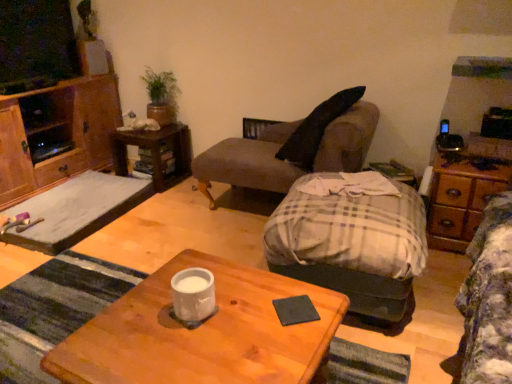
Question: Considering the relative sizes of gray fabric couch at center, positioned as the 2th studio couch in front-to-back order, and wooden dresser at right in the image provided, is gray fabric couch at center, positioned as the 2th studio couch in front-to-back order, thinner than wooden dresser at right?

Choices:
 (A) yes
 (B) no

Answer: (B)

Question: Considering the relative sizes of gray fabric couch at center, placed as the 1th studio couch when sorted from back to front, and wooden dresser at right in the image provided, is gray fabric couch at center, placed as the 1th studio couch when sorted from back to front, bigger than wooden dresser at right?

Choices:
 (A) no
 (B) yes

Answer: (B)

Question: Is gray fabric couch at center, placed as the 1th studio couch when sorted from back to front, at the left side of wooden dresser at right?

Choices:
 (A) yes
 (B) no

Answer: (A)

Question: Is gray fabric couch at center, positioned as the 2th studio couch in front-to-back order, turned away from wooden dresser at right?

Choices:
 (A) no
 (B) yes

Answer: (A)

Question: Is gray fabric couch at center, placed as the 1th studio couch when sorted from back to front, far away from wooden dresser at right?

Choices:
 (A) no
 (B) yes

Answer: (A)

Question: Is plaid fabric ottoman at center, placed as the first studio couch when sorted from front to back, wider or thinner than wooden dresser at right?

Choices:
 (A) wide
 (B) thin

Answer: (A)

Question: Is point (368, 268) positioned closer to the camera than point (486, 175)?

Choices:
 (A) farther
 (B) closer

Answer: (B)

Question: Is plaid fabric ottoman at center, placed as the first studio couch when sorted from front to back, situated inside wooden dresser at right or outside?

Choices:
 (A) outside
 (B) inside

Answer: (A)

Question: From a real-world perspective, is plaid fabric ottoman at center, placed as the first studio couch when sorted from front to back, positioned above or below wooden dresser at right?

Choices:
 (A) above
 (B) below

Answer: (B)

Question: Looking at the image, does wooden desk at center seem bigger or smaller compared to brown wood side table at upper left, positioned as the 2th side table in right-to-left order?

Choices:
 (A) big
 (B) small

Answer: (A)

Question: Is wooden desk at center wider or thinner than brown wood side table at upper left, which is the first side table in back-to-front order?

Choices:
 (A) thin
 (B) wide

Answer: (B)

Question: Is point (217, 276) positioned closer to the camera than point (177, 160)?

Choices:
 (A) closer
 (B) farther

Answer: (A)

Question: From a real-world perspective, is wooden desk at center positioned above or below brown wood side table at upper left, the first side table in the left-to-right sequence?

Choices:
 (A) below
 (B) above

Answer: (B)

Question: Looking at their shapes, would you say brown wood side table at upper left, placed as the second side table when sorted from front to back, is wider or thinner than wooden desk at center?

Choices:
 (A) thin
 (B) wide

Answer: (A)

Question: From the image's perspective, is brown wood side table at upper left, which is the first side table in back-to-front order, above or below wooden desk at center?

Choices:
 (A) below
 (B) above

Answer: (B)